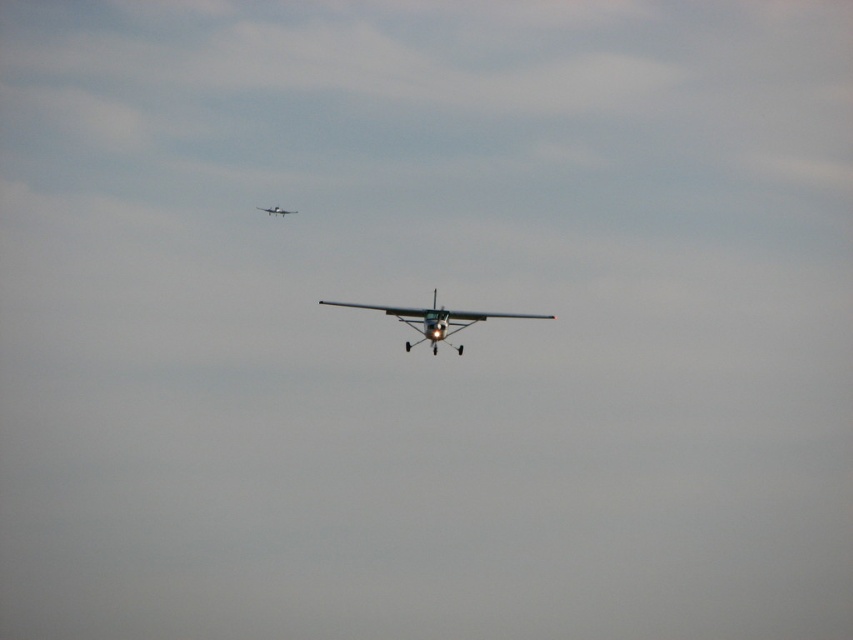
You are a pilot in the metallic silver airplane at center. You notice another metallic silver airplane at upper center in the distance. Based on their sizes, which airplane is closer to you?

The metallic silver airplane at center is larger in size than the metallic silver airplane at upper center, so the metallic silver airplane at center is closer to you.

You are a pilot in the metallic silver airplane at center. You notice another metallic silver airplane at upper center in the sky. Which direction should you turn to avoid collision if the other airplane is on your right side?

The metallic silver airplane at center is positioned on the right side of the metallic silver airplane at upper center, so you should turn left to avoid collision with the metallic silver airplane at upper center.